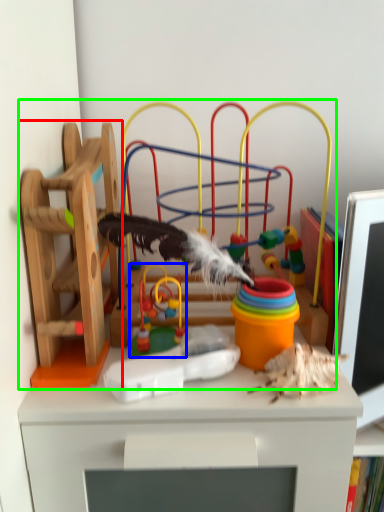
Question: Which object is positioned farthest from toy (highlighted by a red box)? Select from toy (highlighted by a blue box) and toy (highlighted by a green box).

Choices:
 (A) toy
 (B) toy

Answer: (A)